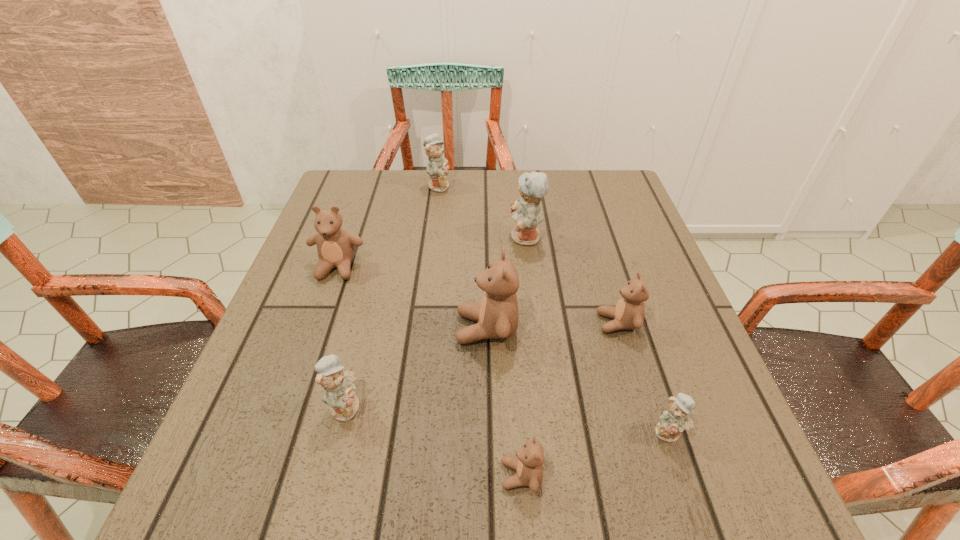
In order to click on the fourth closest teddy bear to the third biggest brown teddy bear in this screenshot , I will do `click(528, 464)`.

Where is `the fifth closest teddy bear relative to the leftmost object`? The height and width of the screenshot is (540, 960). the fifth closest teddy bear relative to the leftmost object is located at coordinates point(528,464).

Select which blue teddy bear is the closest to the sixth nearest teddy bear. Please provide its 2D coordinates. Your answer should be formatted as a tuple, i.e. [(x, y)], where the tuple contains the x and y coordinates of a point satisfying the conditions above.

[(338, 385)]

Choose which blue teddy bear is the third nearest neighbor to the nearest brown teddy bear. Please provide its 2D coordinates. Your answer should be formatted as a tuple, i.e. [(x, y)], where the tuple contains the x and y coordinates of a point satisfying the conditions above.

[(526, 211)]

Identify the location of the second closest brown teddy bear to the second smallest brown teddy bear. (528, 464).

Image resolution: width=960 pixels, height=540 pixels. In order to click on brown teddy bear that is the second closest one to the smallest blue teddy bear in this screenshot , I will do `click(528, 464)`.